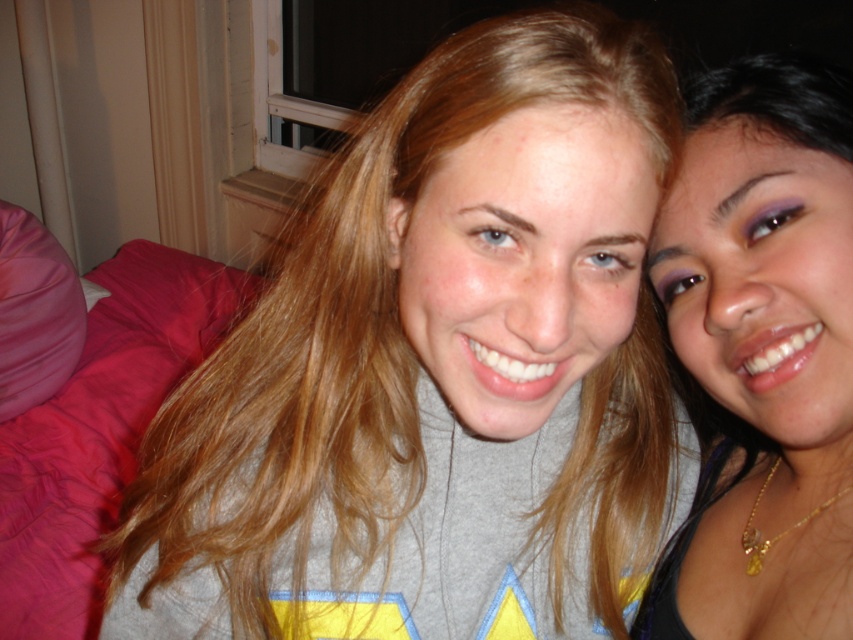
The height and width of the screenshot is (640, 853). Describe the element at coordinates (434, 372) in the screenshot. I see `gray matte sweatshirt at center` at that location.

Is point (560, 625) behind point (770, 632)?

Yes, it is.

The width and height of the screenshot is (853, 640). What are the coordinates of `gray matte sweatshirt at center` in the screenshot? It's located at (434, 372).